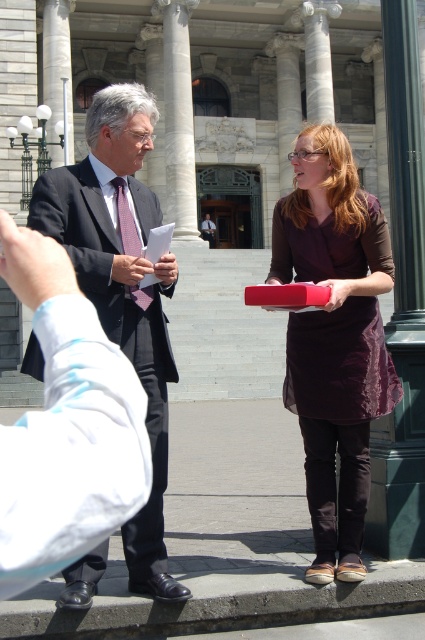
You are an architect designing a new building and want to place a statue exactly at the center of the image. The statue will be placed where the matte purple dress at center is currently located. What are the coordinates where you should place the statue?

The coordinates for the matte purple dress at center are at point (334, 339), so the statue should be placed at those coordinates.

You are a photographer who needs to capture both the matte purple dress at center and the matte black suit at left clearly in a single photo. Based on their positions, which one will appear closer to the camera in the final image?

The matte purple dress at center appears closer to the camera because it is positioned over the matte black suit at left, indicating it is in front.

You are standing in front of the grand classical building and want to take a photo of the two people. The points you need to focus on are point [323,360] and point [82,225]. Which point should you focus on first to ensure both are in focus?

You should focus on point [323,360] first because it is closer to the camera than point [82,225], ensuring both are in focus when focusing on the closer point.